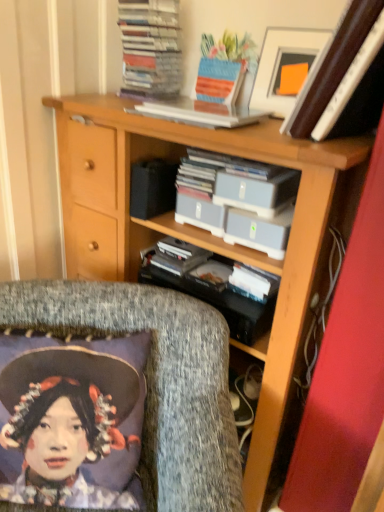
Question: Which direction should I rotate to look at stacked paper at upper center, the 2th book positioned from the bottom?

Choices:
 (A) left
 (B) right

Answer: (A)

Question: From the image's perspective, is textured gray cushion at lower left on top of stacked paper at upper center, the 2th book positioned from the bottom?

Choices:
 (A) no
 (B) yes

Answer: (A)

Question: Considering the relative sizes of textured gray cushion at lower left and stacked paper at upper center, the 2th book positioned from the bottom, in the image provided, is textured gray cushion at lower left smaller than stacked paper at upper center, the 2th book positioned from the bottom,?

Choices:
 (A) yes
 (B) no

Answer: (B)

Question: Is textured gray cushion at lower left to the right of stacked paper at upper center, the 2th book positioned from the bottom, from the viewer's perspective?

Choices:
 (A) yes
 (B) no

Answer: (B)

Question: From the image's perspective, would you say textured gray cushion at lower left is shown under stacked paper at upper center, the first book viewed from the top?

Choices:
 (A) yes
 (B) no

Answer: (A)

Question: From a real-world perspective, is textured gray cushion at lower left over stacked paper at upper center, the 2th book positioned from the bottom?

Choices:
 (A) yes
 (B) no

Answer: (B)

Question: Can you confirm if textured gray cushion at lower left is shorter than stacked paper at upper center, the first book viewed from the top?

Choices:
 (A) no
 (B) yes

Answer: (A)

Question: Can you confirm if textured gray cushion at lower left is thinner than gray plastic case at center?

Choices:
 (A) yes
 (B) no

Answer: (B)

Question: Is textured gray cushion at lower left smaller than gray plastic case at center?

Choices:
 (A) yes
 (B) no

Answer: (B)

Question: Does textured gray cushion at lower left appear on the right side of gray plastic case at center?

Choices:
 (A) yes
 (B) no

Answer: (B)

Question: Can you confirm if textured gray cushion at lower left is bigger than gray plastic case at center?

Choices:
 (A) no
 (B) yes

Answer: (B)

Question: From the image's perspective, is textured gray cushion at lower left on gray plastic case at center?

Choices:
 (A) yes
 (B) no

Answer: (B)

Question: Is gray plastic case at center completely or partially inside textured gray cushion at lower left?

Choices:
 (A) yes
 (B) no

Answer: (B)

Question: Is textured gray cushion at lower left oriented away from wooden bookcase at center?

Choices:
 (A) no
 (B) yes

Answer: (B)